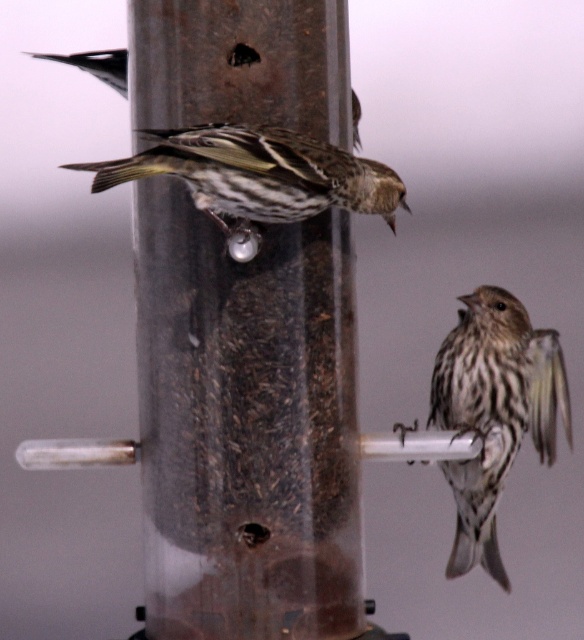
Consider the image. Measure the distance between brown striped sparrow at center and camera.

5.06 feet

Between brown striped sparrow at center and dark brown speckled sparrow at upper left, which one is positioned lower?

brown striped sparrow at center

Between point (203, 202) and point (102, 58), which one is positioned in front?

Point (203, 202)

You are a GUI agent. You are given a task and a screenshot of the screen. Output one action in this format:
    pyautogui.click(x=<x>, y=<y>)
    Task: Click on the brown striped sparrow at center
    Image resolution: width=584 pixels, height=640 pixels.
    Given the screenshot: What is the action you would take?
    pyautogui.click(x=258, y=173)

Measure the distance between brown speckled sparrow at right and dark brown speckled sparrow at upper left.

brown speckled sparrow at right and dark brown speckled sparrow at upper left are 1.05 meters apart.

Does brown speckled sparrow at right appear on the left side of dark brown speckled sparrow at upper left?

Incorrect, brown speckled sparrow at right is not on the left side of dark brown speckled sparrow at upper left.

Is point (482, 520) positioned in front of point (91, 68)?

Yes, point (482, 520) is closer to viewer.

Find the location of a particular element. The width and height of the screenshot is (584, 640). brown speckled sparrow at right is located at coordinates (493, 412).

From the picture: Is brown speckled sparrow at right closer to the viewer compared to brown striped sparrow at center?

No, brown speckled sparrow at right is further to the viewer.

Which is more to the right, brown speckled sparrow at right or brown striped sparrow at center?

brown speckled sparrow at right is more to the right.

Find the location of a particular element. The height and width of the screenshot is (640, 584). brown speckled sparrow at right is located at coordinates (493, 412).